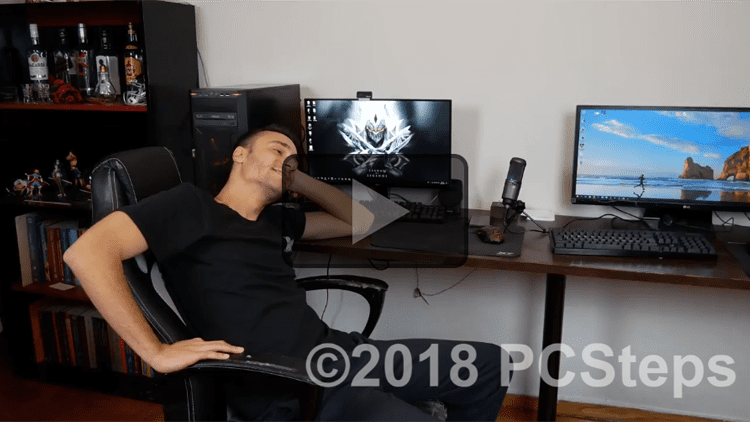
Identify the location of liquor bottles. Image resolution: width=750 pixels, height=422 pixels. (38, 61), (58, 57), (88, 60), (100, 66), (136, 66).